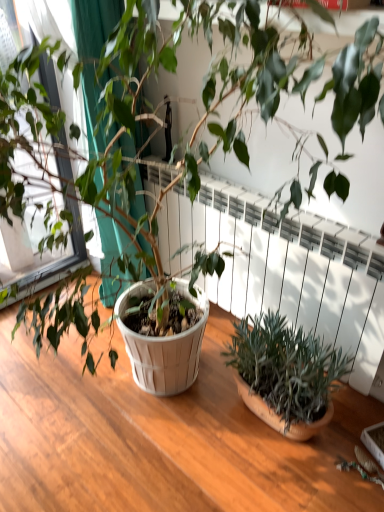
At what (x,y) coordinates should I click in order to perform the action: click on green matte plant at lower right. Please return your answer as a coordinate pair (x, y). The height and width of the screenshot is (512, 384). Looking at the image, I should click on point(285,374).

Measure the distance between point (8, 261) and camera.

They are 2.29 meters apart.

At what (x,y) coordinates should I click in order to perform the action: click on white textured radiator at center. Please return your answer as a coordinate pair (x, y). This screenshot has height=512, width=384. Looking at the image, I should click on (285, 268).

The width and height of the screenshot is (384, 512). In order to click on green matte plant at lower right in this screenshot , I will do `click(285, 374)`.

From the picture: From the image's perspective, is white textured radiator at center located beneath green fabric at left?

Correct, white textured radiator at center appears lower than green fabric at left in the image.

From a real-world perspective, is white textured radiator at center positioned above or below green fabric at left?

From a real-world perspective, white textured radiator at center is physically below green fabric at left.

Is white textured radiator at center not near green fabric at left?

No, white textured radiator at center is in close proximity to green fabric at left.

Can we say white textured radiator at center lies outside green fabric at left?

Yes, white textured radiator at center is outside of green fabric at left.

In terms of width, does white textured radiator at center look wider or thinner when compared to green matte plant at lower right?

Considering their sizes, white textured radiator at center looks slimmer than green matte plant at lower right.

How far apart are white textured radiator at center and green matte plant at lower right?

white textured radiator at center is 10.36 inches from green matte plant at lower right.

Is white textured radiator at center in front of or behind green matte plant at lower right in the image?

Visually, white textured radiator at center is located behind green matte plant at lower right.

From a real-world perspective, which object stands above the other?

white textured radiator at center is physically above.

From a real-world perspective, is green fabric at left above or below green matte plant at lower right?

green fabric at left is situated higher than green matte plant at lower right in the real world.

From the picture: Do you think green fabric at left is within green matte plant at lower right, or outside of it?

green fabric at left is spatially situated outside green matte plant at lower right.

This screenshot has width=384, height=512. I want to click on houseplant below the green fabric at left (from the image's perspective), so click(285, 374).

Is green fabric at left looking in the opposite direction of green matte plant at lower right?

No, green matte plant at lower right is not at the back of green fabric at left.

Between green matte plant at lower right and white textured radiator at center, which one has larger width?

With larger width is green matte plant at lower right.

From the image's perspective, between green matte plant at lower right and white textured radiator at center, which one is located above?

white textured radiator at center.

Would you say green matte plant at lower right is inside or outside white textured radiator at center?

The correct answer is: outside.

Between green matte plant at lower right and green fabric at left, which one has smaller size?

green matte plant at lower right is smaller.

From a real-world perspective, is green matte plant at lower right physically located above or below green fabric at left?

Clearly, from a real-world perspective, green matte plant at lower right is below green fabric at left.

From the image's perspective, between green matte plant at lower right and green fabric at left, which one is located above?

From the image's view, green fabric at left is above.

Could you tell me if green matte plant at lower right is turned towards green fabric at left?

No.

Does green fabric at left lie in front of white textured radiator at center?

That is False.

Is green fabric at left aimed at white textured radiator at center?

Yes, green fabric at left is aimed at white textured radiator at center.

Does point (30, 223) lie in front of point (248, 251)?

Yes, point (30, 223) is in front of point (248, 251).

Where is `window frame on the left side of white textured radiator at center`? This screenshot has width=384, height=512. window frame on the left side of white textured radiator at center is located at coordinates (36, 247).

Where is `houseplant below the white textured radiator at center (from the image's perspective)`? houseplant below the white textured radiator at center (from the image's perspective) is located at coordinates (285, 374).

From the picture: When comparing their distances from white textured radiator at center, does green fabric at left or green matte plant at lower right seem closer?

green matte plant at lower right is closer to white textured radiator at center.

Which object lies nearer to the anchor point white textured radiator at center, green matte plant at lower right or green fabric at left?

Among the two, green matte plant at lower right is located nearer to white textured radiator at center.

Consider the image. From the image, which object appears to be farther from green matte plant at lower right, green fabric at left or white textured radiator at center?

Among the two, green fabric at left is located further to green matte plant at lower right.

Estimate the real-world distances between objects in this image. Which object is closer to green matte plant at lower right, white textured radiator at center or green fabric at left?

white textured radiator at center is positioned closer to the anchor green matte plant at lower right.

Which object lies nearer to the anchor point green fabric at left, white textured radiator at center or green matte plant at lower right?

Among the two, white textured radiator at center is located nearer to green fabric at left.

From the image, which object appears to be nearer to green fabric at left, green matte plant at lower right or white textured radiator at center?

Among the two, white textured radiator at center is located nearer to green fabric at left.

Image resolution: width=384 pixels, height=512 pixels. I want to click on radiator between green fabric at left and green matte plant at lower right from left to right, so click(285, 268).